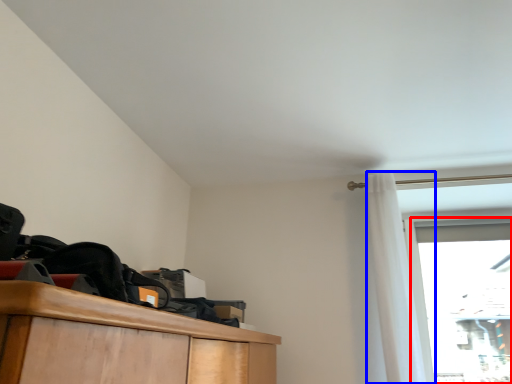
Question: Which of the following is the closest to the observer, glass door (highlighted by a red box) or curtain (highlighted by a blue box)?

Choices:
 (A) glass door
 (B) curtain

Answer: (B)